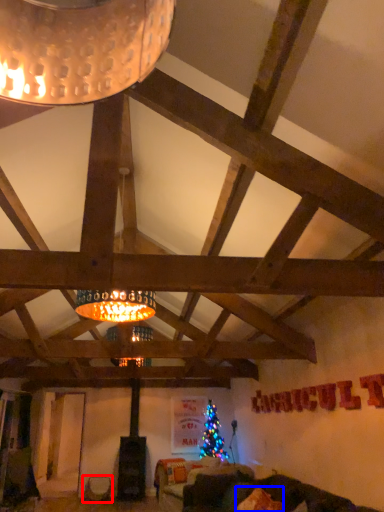
Question: Which object is further to the camera taking this photo, furniture (highlighted by a red box) or pillow (highlighted by a blue box)?

Choices:
 (A) furniture
 (B) pillow

Answer: (A)